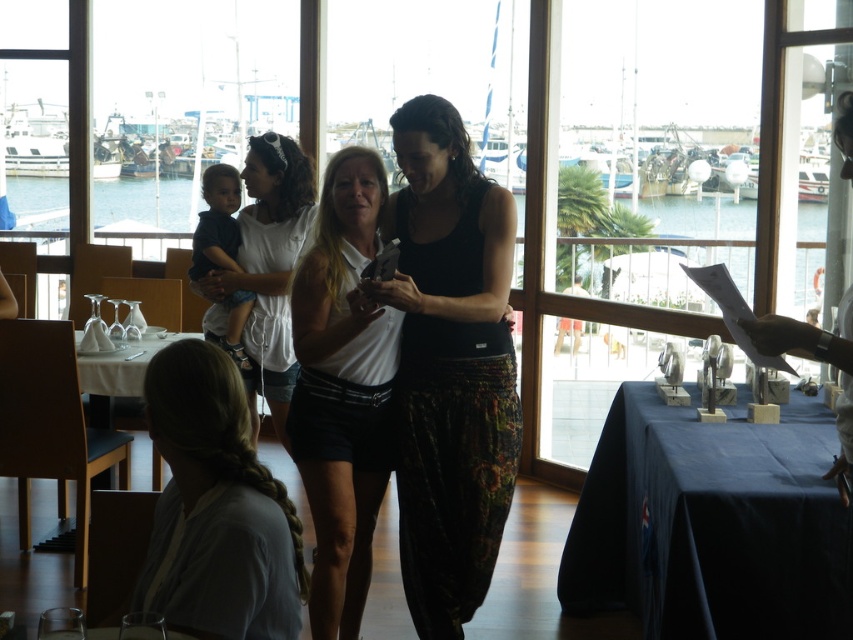
Between white matte shorts at center and white cotton shirt at center, which one has more height?

With more height is white matte shorts at center.

Is white matte shorts at center thinner than white cotton shirt at center?

Indeed, white matte shorts at center has a lesser width compared to white cotton shirt at center.

Is point (331, 349) farther from viewer compared to point (277, 333)?

That is False.

At what (x,y) coordinates should I click in order to perform the action: click on white matte shorts at center. Please return your answer as a coordinate pair (x, y). The width and height of the screenshot is (853, 640). Looking at the image, I should click on click(341, 388).

Is white matte shorts at center positioned behind light gray cotton shirt at lower left?

Yes, it is.

Between white matte shorts at center and light gray cotton shirt at lower left, which one appears on the left side from the viewer's perspective?

light gray cotton shirt at lower left is more to the left.

Find the location of a particular element. Image resolution: width=853 pixels, height=640 pixels. white matte shorts at center is located at coordinates (341, 388).

This screenshot has height=640, width=853. I want to click on black matte tank top at center, so click(450, 365).

Between point (419, 513) and point (177, 582), which one is positioned behind?

The point (419, 513) is behind.

This screenshot has width=853, height=640. I want to click on black matte tank top at center, so click(450, 365).